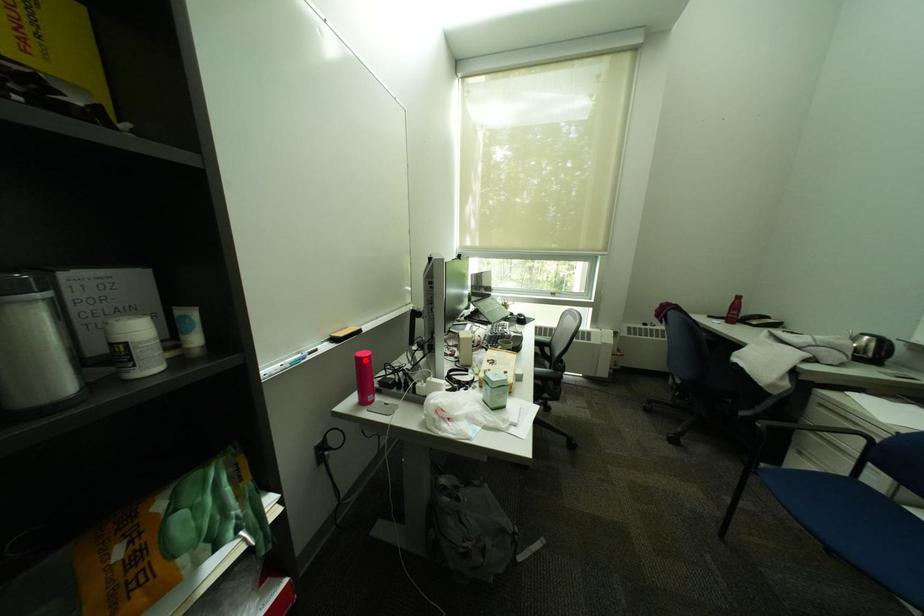
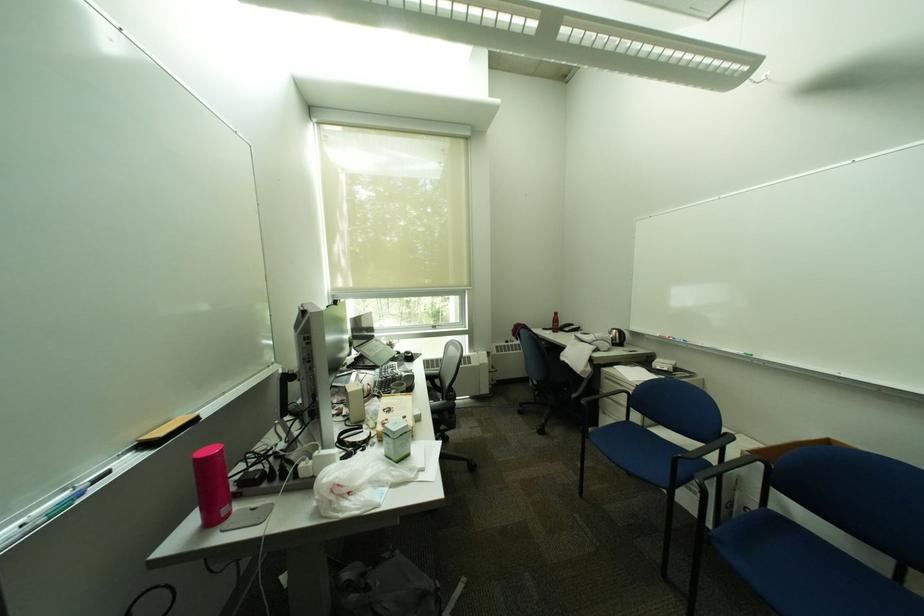
Where in the second image is the point corresponding to the highlighted location from the first image?

(202, 464)